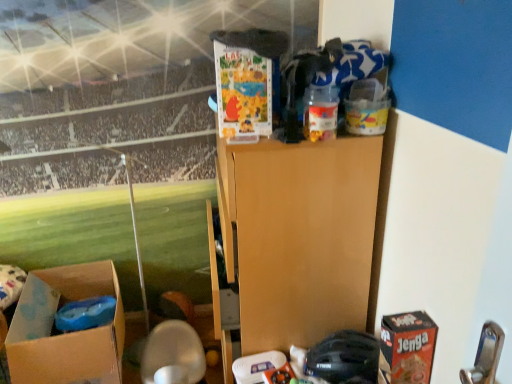
Question: Is black matte helmet at lower center, arranged as the first toy when viewed from the back, at the left side of red cardboard jenga box at lower right?

Choices:
 (A) no
 (B) yes

Answer: (B)

Question: Considering the relative sizes of black matte helmet at lower center, the first toy positioned from the bottom, and red cardboard jenga box at lower right in the image provided, is black matte helmet at lower center, the first toy positioned from the bottom, bigger than red cardboard jenga box at lower right?

Choices:
 (A) yes
 (B) no

Answer: (B)

Question: From the image's perspective, is black matte helmet at lower center, the 2th toy when ordered from front to back, over red cardboard jenga box at lower right?

Choices:
 (A) yes
 (B) no

Answer: (B)

Question: Are black matte helmet at lower center, the 2th toy when ordered from front to back, and red cardboard jenga box at lower right making contact?

Choices:
 (A) no
 (B) yes

Answer: (A)

Question: Does black matte helmet at lower center, the 2th toy when ordered from front to back, come behind red cardboard jenga box at lower right?

Choices:
 (A) no
 (B) yes

Answer: (B)

Question: Is black matte helmet at lower center, the 2th toy viewed from the top, aimed at red cardboard jenga box at lower right?

Choices:
 (A) yes
 (B) no

Answer: (B)

Question: Would you say translucent plastic container at upper center, arranged as the 2th toy when viewed from the back, contains brown cardboard box at lower left, which ranks as the second box in top-to-bottom order?

Choices:
 (A) yes
 (B) no

Answer: (B)

Question: From a real-world perspective, is translucent plastic container at upper center, acting as the 2th toy starting from the bottom, physically below brown cardboard box at lower left, which appears as the first box when viewed from the back?

Choices:
 (A) no
 (B) yes

Answer: (A)

Question: From the image's perspective, is translucent plastic container at upper center, which ranks as the 1th toy in front-to-back order, located beneath brown cardboard box at lower left, which appears as the first box when viewed from the back?

Choices:
 (A) no
 (B) yes

Answer: (A)

Question: Can you confirm if translucent plastic container at upper center, which ranks as the 1th toy in front-to-back order, is wider than brown cardboard box at lower left, arranged as the first box when viewed from the left?

Choices:
 (A) no
 (B) yes

Answer: (A)

Question: Considering the relative positions of translucent plastic container at upper center, acting as the 2th toy starting from the bottom, and brown cardboard box at lower left, which is the second box from right to left, in the image provided, is translucent plastic container at upper center, acting as the 2th toy starting from the bottom, in front of brown cardboard box at lower left, which is the second box from right to left,?

Choices:
 (A) yes
 (B) no

Answer: (A)

Question: Is translucent plastic container at upper center, acting as the 2th toy starting from the bottom, shorter than brown cardboard box at lower left, which ranks as the second box in top-to-bottom order?

Choices:
 (A) yes
 (B) no

Answer: (A)

Question: From a real-world perspective, is translucent plastic container at upper center, which ranks as the 1th toy in front-to-back order, positioned under red cardboard jenga box at lower right based on gravity?

Choices:
 (A) no
 (B) yes

Answer: (A)